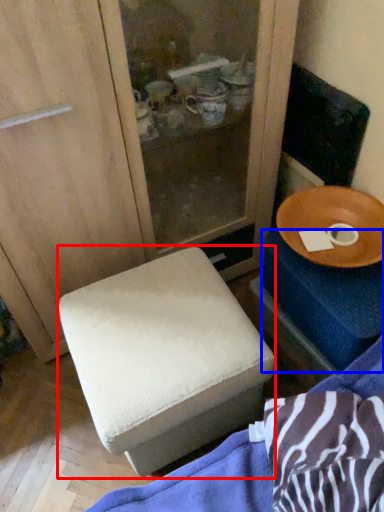
Question: Which object appears farthest to the camera in this image, furniture (highlighted by a red box) or changing table (highlighted by a blue box)?

Choices:
 (A) furniture
 (B) changing table

Answer: (B)